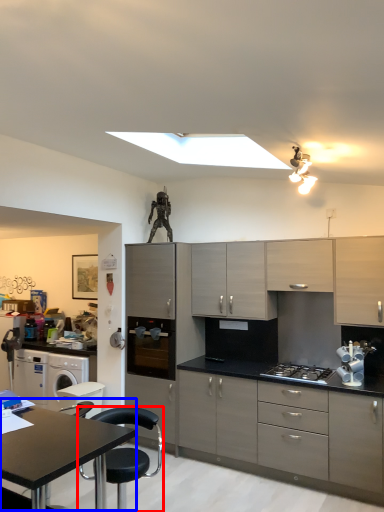
Question: Among these objects, which one is farthest to the camera, chair (highlighted by a red box) or table (highlighted by a blue box)?

Choices:
 (A) chair
 (B) table

Answer: (A)